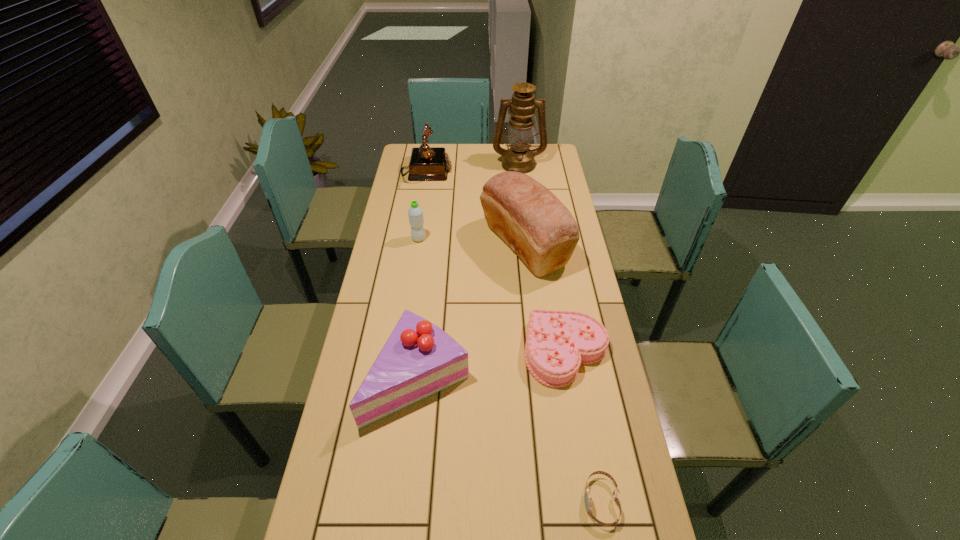
You are a GUI agent. You are given a task and a screenshot of the screen. Output one action in this format:
    pyautogui.click(x=<x>, y=<y>)
    Task: Click on the tallest object
    The image size is (960, 540).
    Given the screenshot: What is the action you would take?
    pyautogui.click(x=519, y=158)

Find the location of a particular element. bread is located at coordinates (528, 217).

Identify the location of telephone. (426, 163).

Identify the location of water bottle. (415, 212).

Locate an element on the screen. This screenshot has height=540, width=960. the taller cake is located at coordinates (419, 359).

The width and height of the screenshot is (960, 540). Identify the location of the right cake. (557, 342).

What are the coordinates of `the sixth tallest object` in the screenshot? It's located at (557, 342).

Identify the location of watch. click(587, 496).

Where is `the shortest object`? This screenshot has width=960, height=540. the shortest object is located at coordinates (587, 496).

Find the location of a particular element. vacant space situated on the left of the oil lamp is located at coordinates (420, 164).